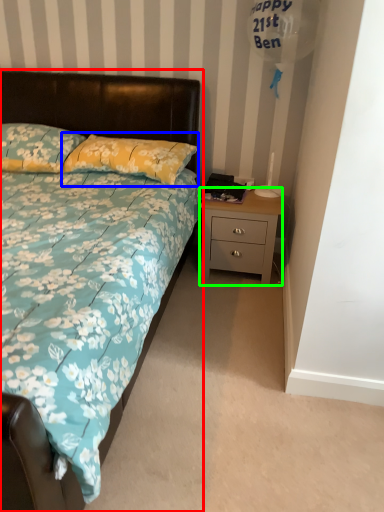
Question: Based on their relative distances, which object is farther from bed (highlighted by a red box)? Choose from pillow (highlighted by a blue box) and nightstand (highlighted by a green box).

Choices:
 (A) pillow
 (B) nightstand

Answer: (B)